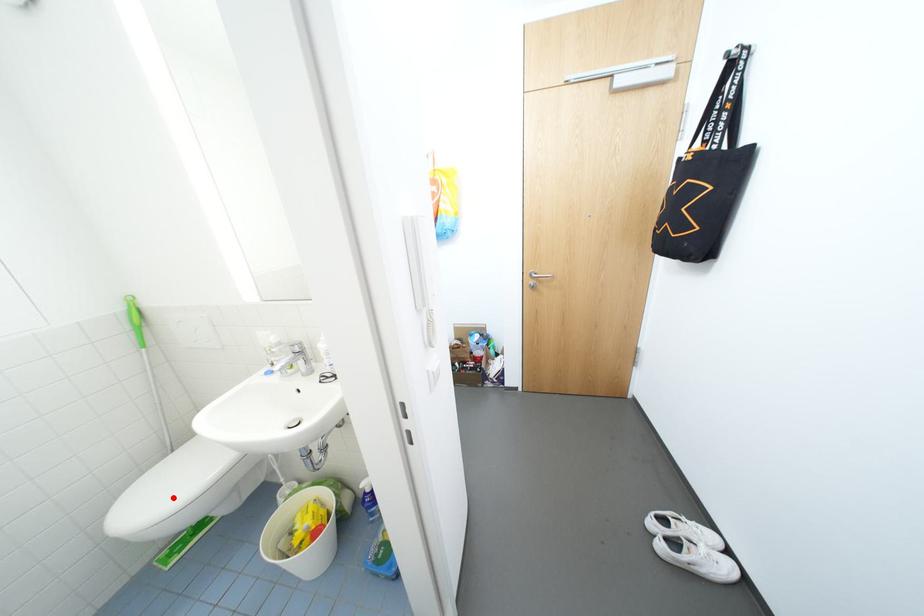
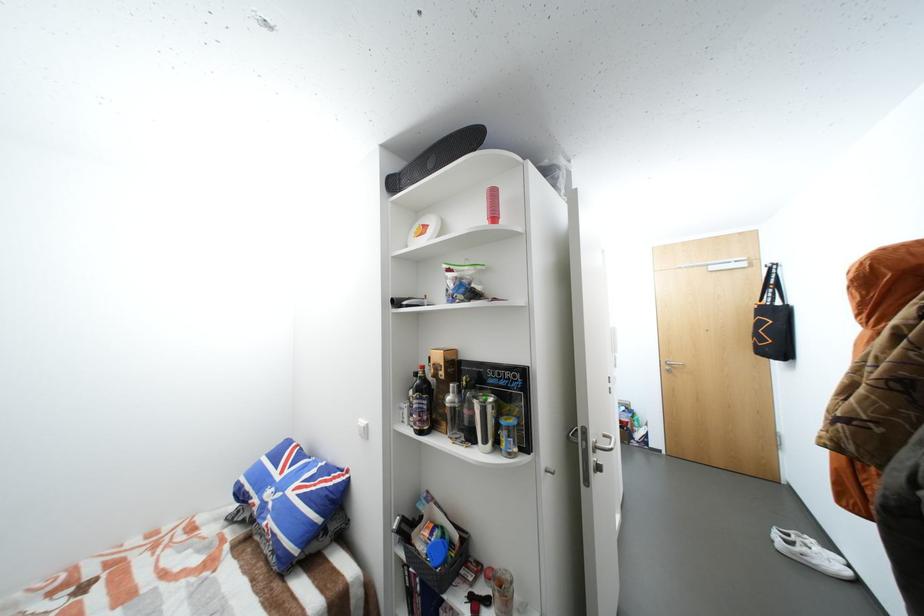
Question: I am providing you with two images of the same scene from different viewpoints. A red point is marked on the first image. Can you still see the location of the red point in image 2?

Choices:
 (A) Yes
 (B) No

Answer: (B)